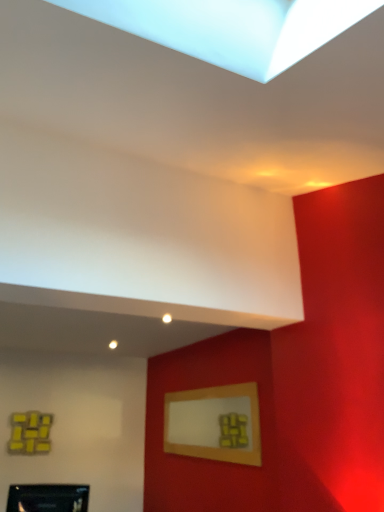
Question: Is matte black picture frame at lower left, placed as the second picture frame when sorted from right to left, spatially inside wooden picture frame at upper center, the second picture frame positioned from the left, or outside of it?

Choices:
 (A) inside
 (B) outside

Answer: (B)

Question: From a real-world perspective, is matte black picture frame at lower left, which is the first picture frame from left to right, positioned above or below wooden picture frame at upper center, the 1th picture frame from the right?

Choices:
 (A) below
 (B) above

Answer: (A)

Question: Considering the positions of matte black picture frame at lower left, placed as the second picture frame when sorted from right to left, and wooden picture frame at upper center, arranged as the second picture frame when viewed from the front, in the image, is matte black picture frame at lower left, placed as the second picture frame when sorted from right to left, taller or shorter than wooden picture frame at upper center, arranged as the second picture frame when viewed from the front,?

Choices:
 (A) tall
 (B) short

Answer: (B)

Question: In terms of size, does wooden picture frame at upper center, the 1th picture frame positioned from the back, appear bigger or smaller than matte black picture frame at lower left, which is the first picture frame from left to right?

Choices:
 (A) big
 (B) small

Answer: (A)

Question: Is wooden picture frame at upper center, the second picture frame positioned from the left, spatially inside matte black picture frame at lower left, acting as the second picture frame starting from the back, or outside of it?

Choices:
 (A) inside
 (B) outside

Answer: (B)

Question: Is wooden picture frame at upper center, the second picture frame positioned from the left, in front of or behind matte black picture frame at lower left, acting as the second picture frame starting from the back, in the image?

Choices:
 (A) behind
 (B) front

Answer: (A)

Question: Is wooden picture frame at upper center, the 1th picture frame positioned from the back, wider or thinner than matte black picture frame at lower left, which appears as the 1th picture frame when viewed from the front?

Choices:
 (A) wide
 (B) thin

Answer: (B)